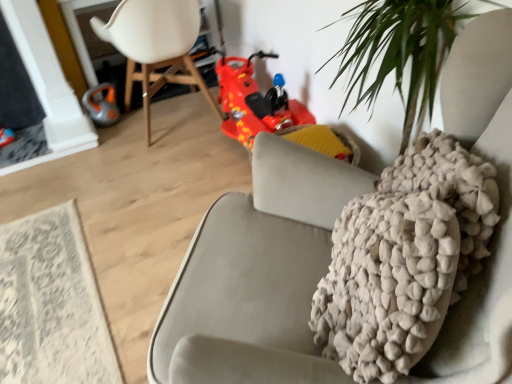
This screenshot has height=384, width=512. Identify the location of vacant space underneath orange rubber vacuum cleaner at left (from a real-world perspective). (111, 122).